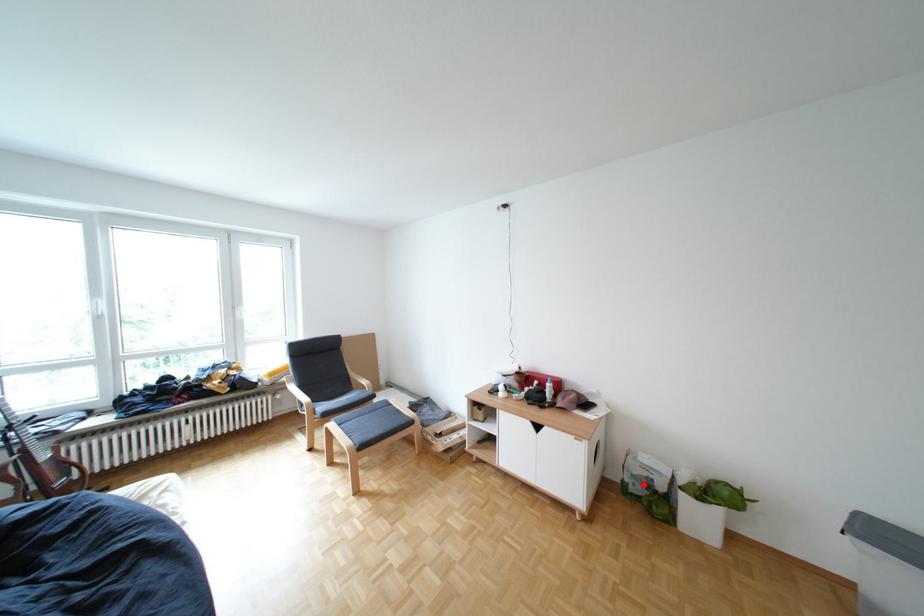
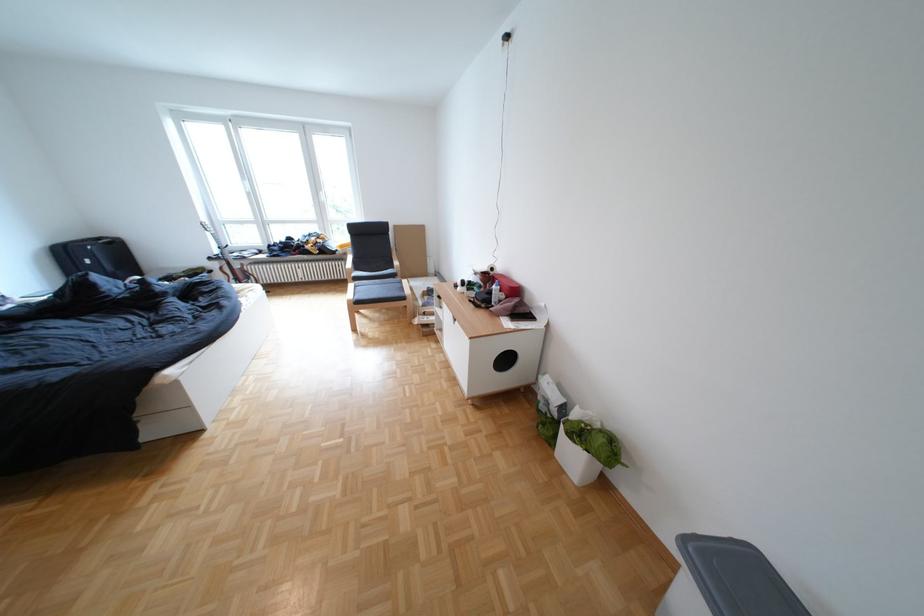
Question: I am providing you with two images of the same scene from different viewpoints. Given a red point in image1, look at the same physical point in image2. Is it:

Choices:
 (A) Closer to the viewpoint
 (B) Farther from the viewpoint

Answer: (A)